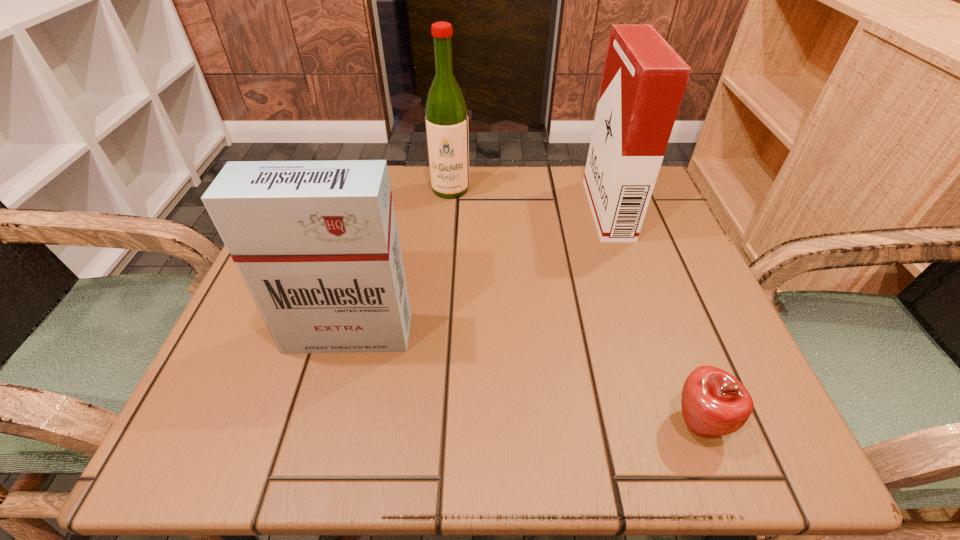
What are the coordinates of `free area in between the farther cigarette case and the shortest object` in the screenshot? It's located at (653, 316).

I want to click on vacant area between the nearest object and the nearer cigarette case, so click(x=523, y=379).

Locate which object ranks in proximity to the nearer cigarette case. Please provide its 2D coordinates. Your answer should be formatted as a tuple, i.e. [(x, y)], where the tuple contains the x and y coordinates of a point satisfying the conditions above.

[(446, 118)]

Identify the location of object that is the third closest one to the apple. This screenshot has height=540, width=960. (446, 118).

This screenshot has width=960, height=540. Identify the location of free space that satisfies the following two spatial constraints: 1. on the front-facing side of the shortest object; 2. on the right side of the right cigarette case. (681, 424).

Find the location of `vacant region that satisfies the following two spatial constraints: 1. on the front side of the nearer cigarette case; 2. on the left side of the nearest object`. vacant region that satisfies the following two spatial constraints: 1. on the front side of the nearer cigarette case; 2. on the left side of the nearest object is located at coordinates (325, 424).

Image resolution: width=960 pixels, height=540 pixels. I want to click on vacant space that satisfies the following two spatial constraints: 1. on the label of the apple; 2. on the right side of the liquor, so click(431, 424).

This screenshot has height=540, width=960. In order to click on vacant area that satisfies the following two spatial constraints: 1. on the front-facing side of the right cigarette case; 2. on the right side of the nearest object in this screenshot , I will do `click(681, 424)`.

In order to click on vacant area that satisfies the following two spatial constraints: 1. on the front-facing side of the nearest object; 2. on the left side of the farther cigarette case in this screenshot , I will do `click(681, 424)`.